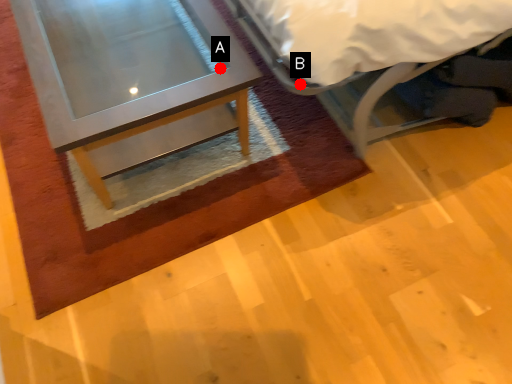
Question: Two points are circled on the image, labeled by A and B beside each circle. Which point is further to the camera?

Choices:
 (A) A is further
 (B) B is further

Answer: (A)